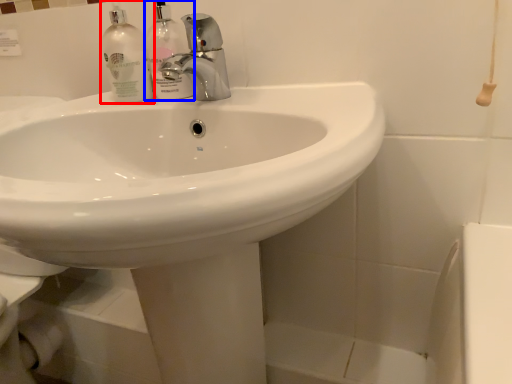
Question: Which of the following is the farthest to the observer, cleaning product (highlighted by a red box) or cleaning product (highlighted by a blue box)?

Choices:
 (A) cleaning product
 (B) cleaning product

Answer: (A)